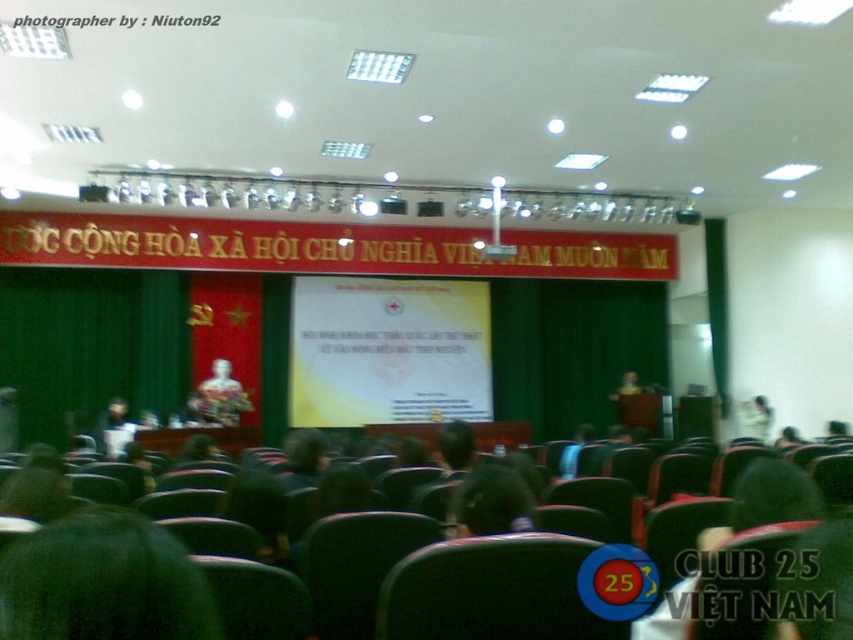
Question: Can you confirm if matte gold statue at center is positioned below matte white shirt at center?

Choices:
 (A) no
 (B) yes

Answer: (A)

Question: Is yellow matte projection screen at center bigger than matte gold statue at center?

Choices:
 (A) no
 (B) yes

Answer: (B)

Question: Is yellow matte projection screen at center above matte white shirt at center?

Choices:
 (A) yes
 (B) no

Answer: (A)

Question: Which of the following is the closest to the observer?

Choices:
 (A) yellow matte projection screen at center
 (B) matte gold statue at center

Answer: (B)

Question: Which object is the closest to the dark green leaf at lower left?

Choices:
 (A) matte gold statue at center
 (B) matte white shirt at center

Answer: (A)

Question: Which point is closer to the camera taking this photo?

Choices:
 (A) (448, 339)
 (B) (755, 426)
 (C) (180, 596)

Answer: (C)